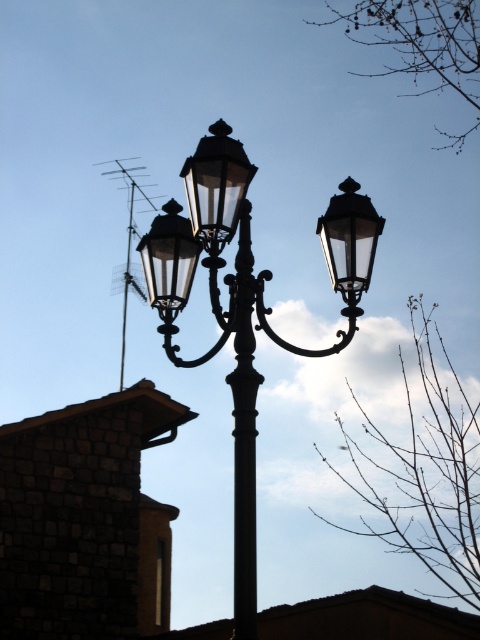
Who is positioned more to the right, matte glass streetlight at upper right or matte glass streetlight at center?

matte glass streetlight at upper right

Is matte glass streetlight at upper right behind matte glass streetlight at center?

That is True.

Find the location of a particular element. matte glass streetlight at upper right is located at coordinates (349, 237).

Is matte black streetlight at center smaller than matte glass streetlight at center?

Actually, matte black streetlight at center might be larger than matte glass streetlight at center.

Looking at this image, can you confirm if matte black streetlight at center is positioned below matte glass streetlight at center?

Yes.

Describe the element at coordinates (178, 275) in the screenshot. I see `matte black streetlight at center` at that location.

Locate an element on the screen. Image resolution: width=480 pixels, height=640 pixels. matte black streetlight at center is located at coordinates (178, 275).

Does black wrought iron pole at center have a larger size compared to matte glass streetlight at upper right?

Correct, black wrought iron pole at center is larger in size than matte glass streetlight at upper right.

Does black wrought iron pole at center have a lesser height compared to matte glass streetlight at upper right?

Incorrect, black wrought iron pole at center's height does not fall short of matte glass streetlight at upper right's.

Between point (248, 452) and point (326, 227), which one is positioned behind?

Point (326, 227)

Identify the location of black wrought iron pole at center. Image resolution: width=480 pixels, height=640 pixels. (243, 432).